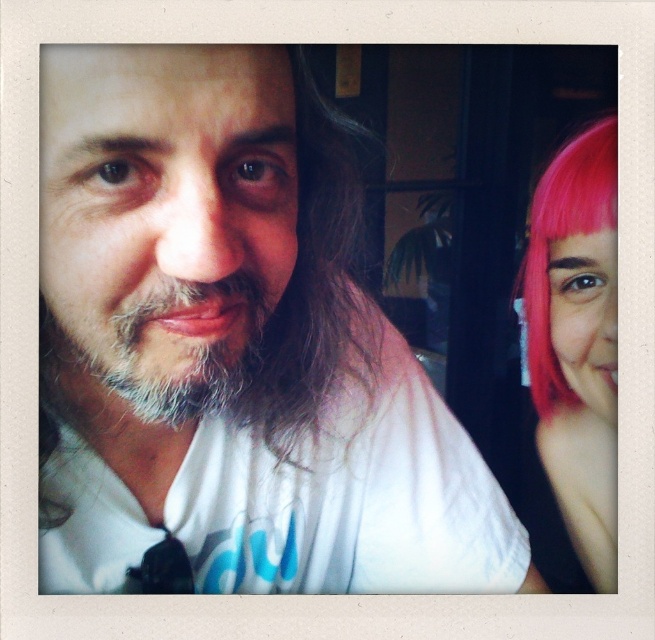
Does pink hair at right appear under graysoftbeard at center?

Yes.

Between point (534, 348) and point (88, 342), which one is positioned in front?

Positioned in front is point (88, 342).

Is point (567, 276) positioned behind point (189, 307)?

Yes, point (567, 276) is behind point (189, 307).

Where is `pink hair at right`? The height and width of the screenshot is (640, 655). pink hair at right is located at coordinates (576, 340).

Does point (103, 429) come in front of point (574, 428)?

Yes, it is in front of point (574, 428).

Who is more forward, (x=365, y=468) or (x=614, y=163)?

Point (x=365, y=468) is in front.

At what (x,y) coordinates should I click in order to perform the action: click on white matte shirt at center. Please return your answer as a coordinate pair (x, y). The width and height of the screenshot is (655, 640). Looking at the image, I should click on (x=233, y=348).

Does white matte shirt at center lie behind graysoftbeard at center?

No.

Measure the distance from white matte shirt at center to graysoftbeard at center.

8.30 centimeters

This screenshot has height=640, width=655. In order to click on white matte shirt at center in this screenshot , I will do `click(233, 348)`.